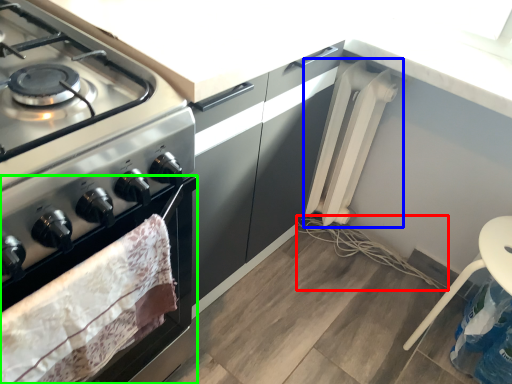
Question: Estimate the real-world distances between objects in this image. Which object is farther from string (highlighted by a red box), appliance (highlighted by a blue box) or oven (highlighted by a green box)?

Choices:
 (A) appliance
 (B) oven

Answer: (B)